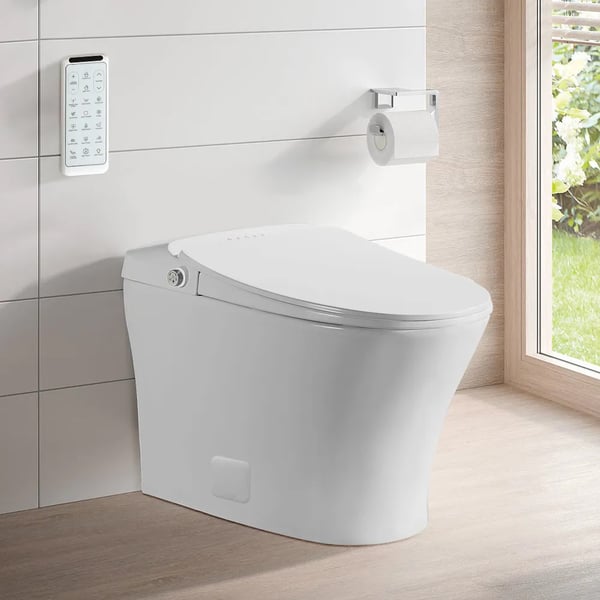
Where is `on the left of the toilet`? Image resolution: width=600 pixels, height=600 pixels. on the left of the toilet is located at coordinates (138, 517).